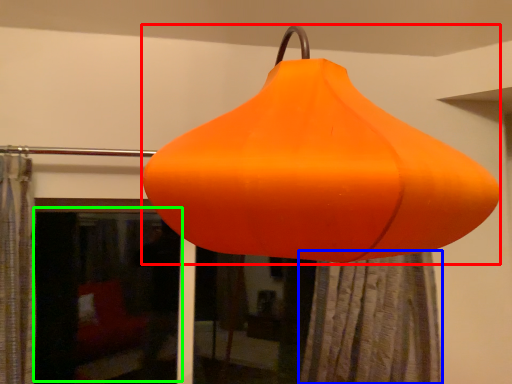
Question: Based on their relative distances, which object is farther from lantern (highlighted by a red box)? Choose from shower curtain (highlighted by a blue box) and window screen (highlighted by a green box).

Choices:
 (A) shower curtain
 (B) window screen

Answer: (B)